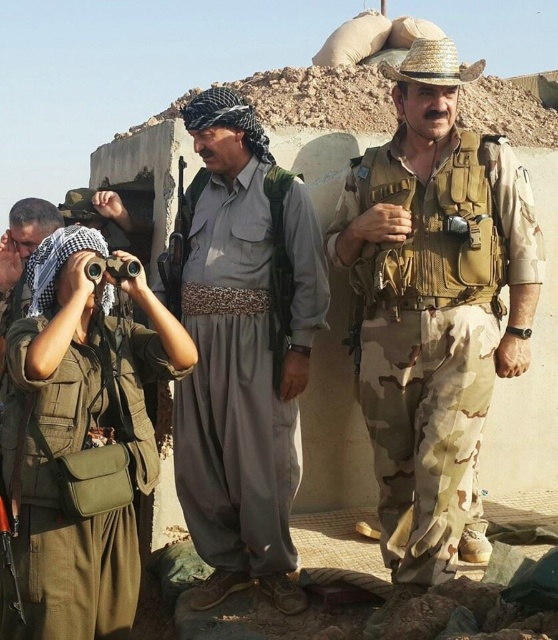
Question: Which object appears closest to the camera in this image?

Choices:
 (A) green fabric uniform at left
 (B) camouflage fabric vest at right

Answer: (A)

Question: Among these objects, which one is farthest from the camera?

Choices:
 (A) gray fabric pants at center
 (B) camouflage fabric vest at right
 (C) green fabric uniform at left

Answer: (A)

Question: Does gray fabric pants at center appear on the right side of green fabric uniform at left?

Choices:
 (A) no
 (B) yes

Answer: (B)

Question: Is camouflage fabric vest at right bigger than gray fabric pants at center?

Choices:
 (A) yes
 (B) no

Answer: (A)

Question: Which point appears closest to the camera in this image?

Choices:
 (A) (496, 227)
 (B) (76, 442)

Answer: (B)

Question: Can you confirm if camouflage fabric vest at right is smaller than green fabric uniform at left?

Choices:
 (A) yes
 (B) no

Answer: (B)